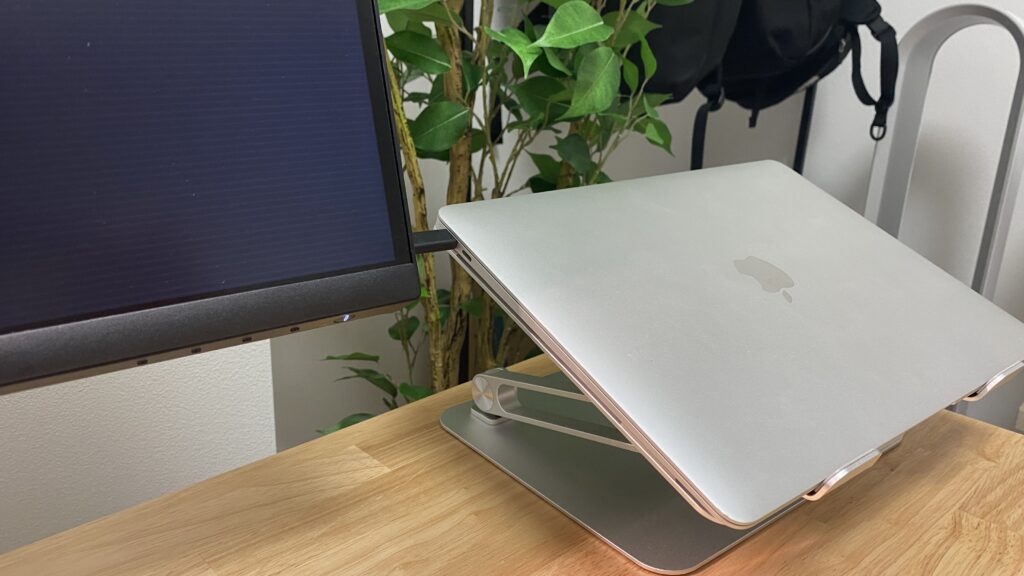
The height and width of the screenshot is (576, 1024). Identify the location of wooden table top. (391, 507).